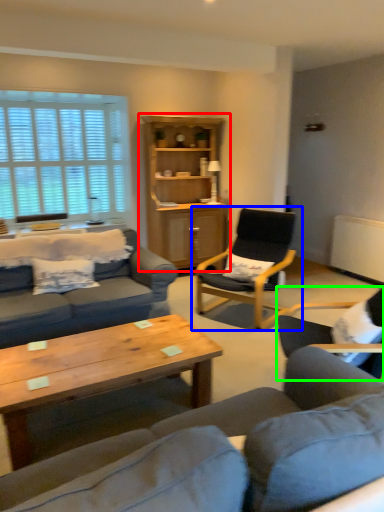
Question: Estimate the real-world distances between objects in this image. Which object is closer to cabinetry (highlighted by a red box), chair (highlighted by a blue box) or chair (highlighted by a green box)?

Choices:
 (A) chair
 (B) chair

Answer: (A)